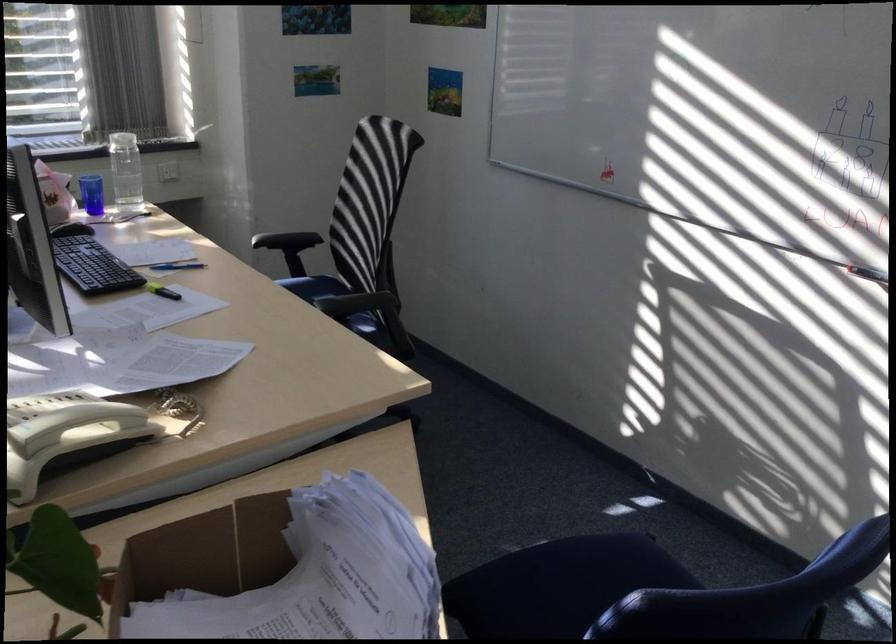
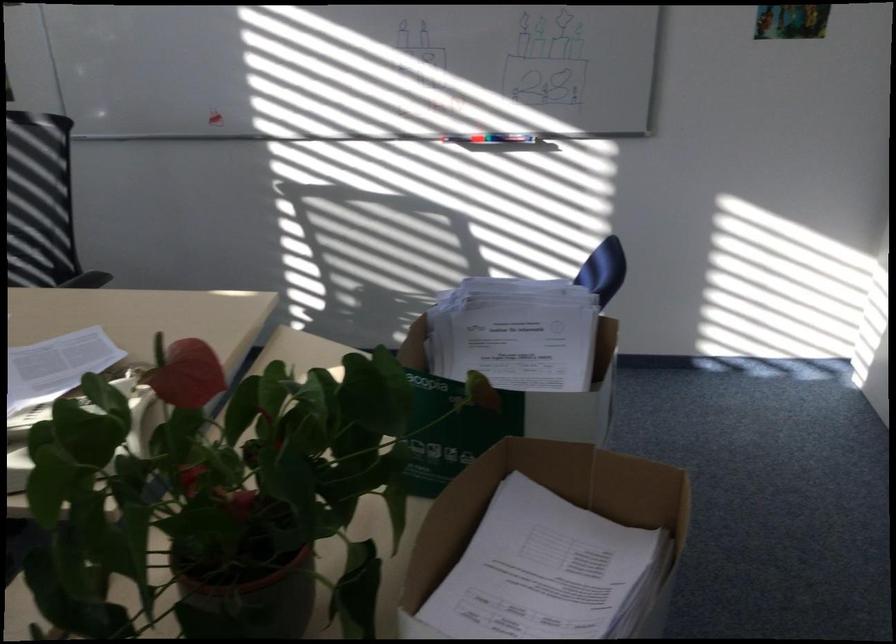
Question: I am providing you with two images of the same scene from different viewpoints. Which of the following objects are not visible in image2?

Choices:
 (A) blue ribbon
 (B) small white lamp
 (C) whiteboard marker
 (D) blue chair sitting surface

Answer: (D)